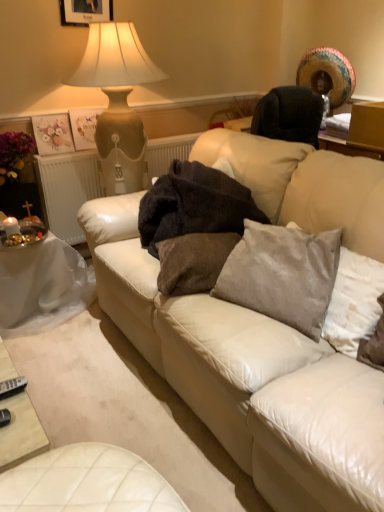
Question: Can you confirm if dark brown plush blanket at center is wider than white textured radiator at left?

Choices:
 (A) yes
 (B) no

Answer: (A)

Question: Is the depth of dark brown plush blanket at center greater than that of white textured radiator at left?

Choices:
 (A) yes
 (B) no

Answer: (B)

Question: From the image's perspective, is dark brown plush blanket at center below white textured radiator at left?

Choices:
 (A) no
 (B) yes

Answer: (B)

Question: Does dark brown plush blanket at center appear on the right side of white textured radiator at left?

Choices:
 (A) no
 (B) yes

Answer: (B)

Question: Is dark brown plush blanket at center in contact with white textured radiator at left?

Choices:
 (A) yes
 (B) no

Answer: (B)

Question: Are dark brown plush blanket at center and white textured radiator at left located far from each other?

Choices:
 (A) yes
 (B) no

Answer: (B)

Question: Considering the relative sizes of white plastic table at lower left and matte white picture frame at upper center in the image provided, is white plastic table at lower left bigger than matte white picture frame at upper center?

Choices:
 (A) no
 (B) yes

Answer: (B)

Question: Is matte white picture frame at upper center completely or partially inside white plastic table at lower left?

Choices:
 (A) no
 (B) yes

Answer: (A)

Question: Is white plastic table at lower left shorter than matte white picture frame at upper center?

Choices:
 (A) yes
 (B) no

Answer: (B)

Question: From a real-world perspective, is white plastic table at lower left located beneath matte white picture frame at upper center?

Choices:
 (A) yes
 (B) no

Answer: (A)

Question: Considering the relative positions of white plastic table at lower left and matte white picture frame at upper center in the image provided, is white plastic table at lower left to the left of matte white picture frame at upper center from the viewer's perspective?

Choices:
 (A) yes
 (B) no

Answer: (A)

Question: Is white plastic table at lower left wider than matte white picture frame at upper center?

Choices:
 (A) no
 (B) yes

Answer: (B)

Question: From a real-world perspective, is dark brown plush blanket at center located beneath satin gray pillow at center, which ranks as the first pillow in right-to-left order?

Choices:
 (A) yes
 (B) no

Answer: (B)